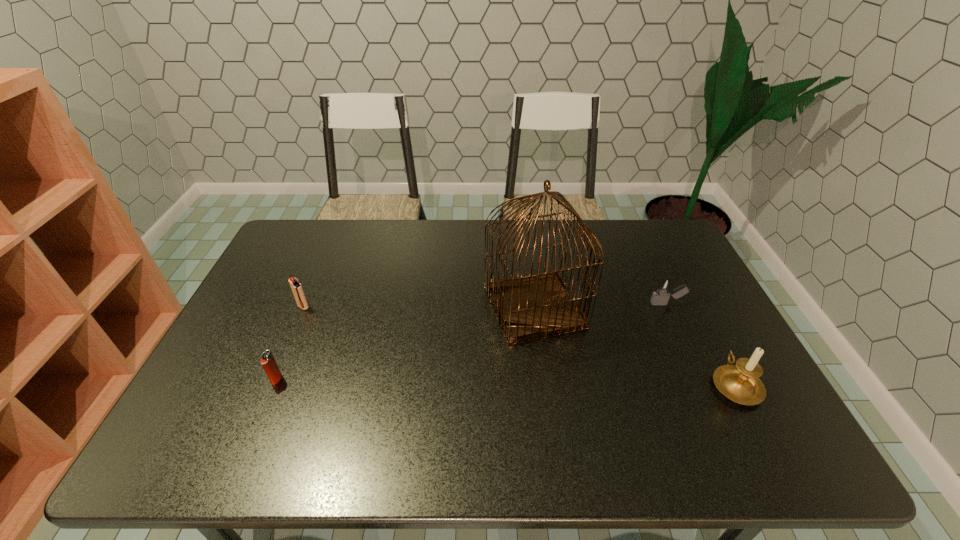
The width and height of the screenshot is (960, 540). Identify the location of free space located 0.380m on the back of the nearest igniter. (320, 276).

Locate an element on the screen. object situated at the left edge is located at coordinates (298, 292).

The height and width of the screenshot is (540, 960). Find the location of `candle holder that is at the right edge`. candle holder that is at the right edge is located at coordinates (740, 383).

The height and width of the screenshot is (540, 960). Find the location of `igniter situated at the right edge`. igniter situated at the right edge is located at coordinates (664, 286).

In the image, there is a desktop. Identify the location of blank space at the far edge. The image size is (960, 540). (424, 239).

Image resolution: width=960 pixels, height=540 pixels. Find the location of `free space at the left edge of the desktop`. free space at the left edge of the desktop is located at coordinates (283, 287).

The height and width of the screenshot is (540, 960). Find the location of `free space at the far left corner of the desktop`. free space at the far left corner of the desktop is located at coordinates (300, 237).

You are a GUI agent. You are given a task and a screenshot of the screen. Output one action in this format:
    pyautogui.click(x=<x>, y=<y>)
    Task: Click on the vacant space in between the third object from left to right and the second tallest object
    The height and width of the screenshot is (540, 960).
    Given the screenshot: What is the action you would take?
    pyautogui.click(x=635, y=346)

Find the location of `unoccupied position between the candle holder and the birdcage`. unoccupied position between the candle holder and the birdcage is located at coordinates (635, 346).

Identify the location of free space that is in between the tallest object and the nearest igniter. The image size is (960, 540). (405, 343).